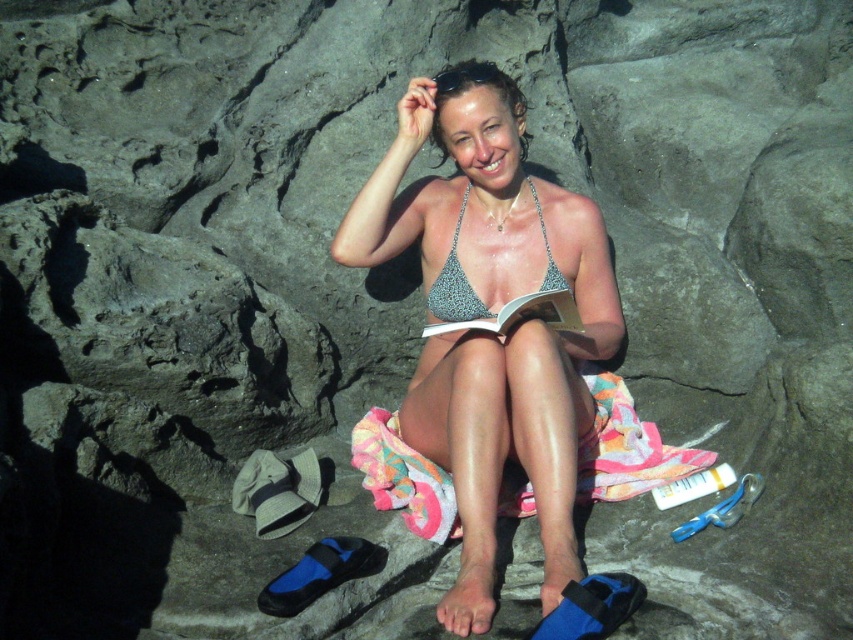
Does metallic bikini top at center appear on the left side of sparkly silver bikini top at center?

In fact, metallic bikini top at center is to the right of sparkly silver bikini top at center.

Is metallic bikini top at center smaller than sparkly silver bikini top at center?

No.

Between point (496, 353) and point (459, 262), which one is positioned in front?

Point (496, 353)

You are a GUI agent. You are given a task and a screenshot of the screen. Output one action in this format:
    pyautogui.click(x=<x>, y=<y>)
    Task: Click on the metallic bikini top at center
    This screenshot has width=853, height=640.
    Given the screenshot: What is the action you would take?
    pyautogui.click(x=490, y=317)